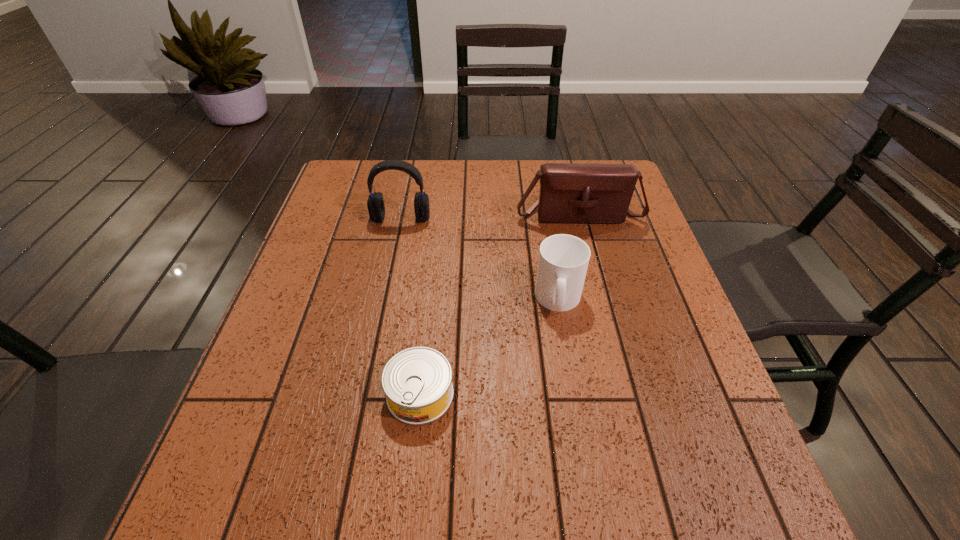
This screenshot has height=540, width=960. What are the coordinates of `headset` in the screenshot? It's located at (375, 203).

Locate an element on the screen. Image resolution: width=960 pixels, height=540 pixels. shoulder bag is located at coordinates (569, 193).

Locate an element on the screen. mug is located at coordinates [563, 260].

This screenshot has height=540, width=960. What are the coordinates of `the third farthest object` in the screenshot? It's located at (563, 260).

Find the location of a particular element. the shortest object is located at coordinates [417, 381].

Find the location of a particular element. This screenshot has height=540, width=960. the nearest object is located at coordinates (417, 381).

Where is `free location located 0.400m on the headband of the headset`? The height and width of the screenshot is (540, 960). free location located 0.400m on the headband of the headset is located at coordinates (374, 346).

The height and width of the screenshot is (540, 960). Identify the location of free space located on the front flap of the shoulder bag. (591, 262).

The height and width of the screenshot is (540, 960). In order to click on vacant space located on the handle side of the second nearest object in this screenshot , I will do `click(578, 413)`.

At what (x,y) coordinates should I click in order to perform the action: click on free spot located 0.360m on the right of the nearest object. Please return your answer as a coordinate pair (x, y). The image size is (960, 540). Looking at the image, I should click on (642, 394).